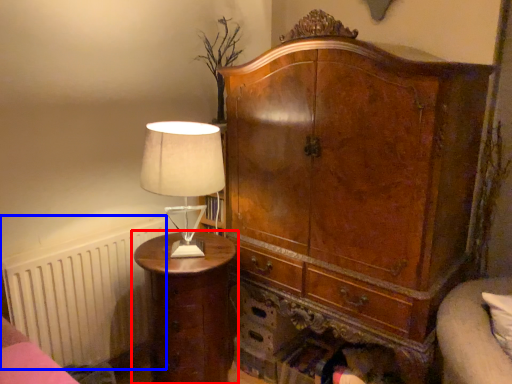
Question: Which of the following is the farthest to the observer, nightstand (highlighted by a red box) or radiator (highlighted by a blue box)?

Choices:
 (A) nightstand
 (B) radiator

Answer: (B)